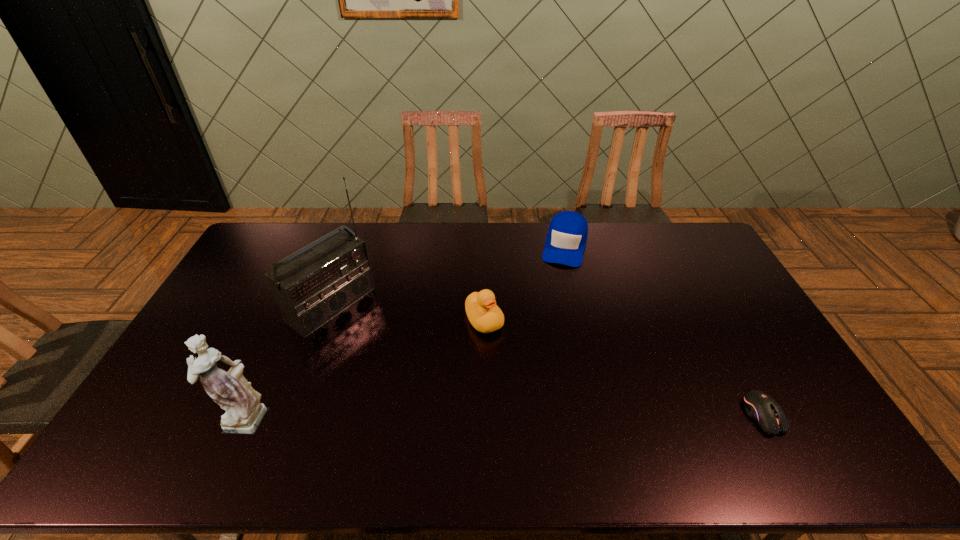
You are a GUI agent. You are given a task and a screenshot of the screen. Output one action in this format:
    pyautogui.click(x=<x>, y=<y>)
    Task: Click on the vacant spot on the desktop that is between the figurine and the computer mouse and is positioned on the front panel of the radio receiver
    
    Given the screenshot: What is the action you would take?
    pyautogui.click(x=495, y=416)

The height and width of the screenshot is (540, 960). Identify the location of free space on the desktop that is between the figurine and the rightmost object and is positioned on the face of the third object from right to left. (558, 416).

I want to click on vacant space on the desktop that is between the figurine and the rightmost object and is positioned on the front-facing side of the second shortest object, so click(x=519, y=416).